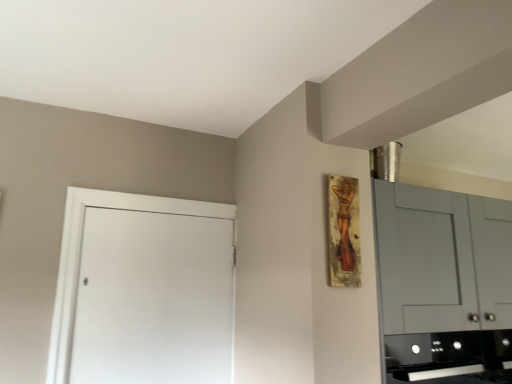
Question: From a real-world perspective, is black glossy oven at lower right physically above white matte door at left?

Choices:
 (A) no
 (B) yes

Answer: (A)

Question: Can you confirm if black glossy oven at lower right is smaller than white matte door at left?

Choices:
 (A) yes
 (B) no

Answer: (B)

Question: Is black glossy oven at lower right positioned with its back to white matte door at left?

Choices:
 (A) yes
 (B) no

Answer: (B)

Question: Does black glossy oven at lower right contain white matte door at left?

Choices:
 (A) yes
 (B) no

Answer: (B)

Question: From a real-world perspective, is black glossy oven at lower right below white matte door at left?

Choices:
 (A) no
 (B) yes

Answer: (B)

Question: Can you confirm if black glossy oven at lower right is positioned to the left of white matte door at left?

Choices:
 (A) yes
 (B) no

Answer: (B)

Question: Is black glossy oven at lower right inside white matte door at left?

Choices:
 (A) no
 (B) yes

Answer: (A)

Question: Is white matte door at left next to black glossy oven at lower right?

Choices:
 (A) yes
 (B) no

Answer: (B)

Question: Can you confirm if white matte door at left is thinner than black glossy oven at lower right?

Choices:
 (A) yes
 (B) no

Answer: (A)

Question: Can we say white matte door at left lies outside black glossy oven at lower right?

Choices:
 (A) yes
 (B) no

Answer: (A)

Question: Does white matte door at left have a larger size compared to black glossy oven at lower right?

Choices:
 (A) no
 (B) yes

Answer: (A)

Question: Is white matte door at left taller than black glossy oven at lower right?

Choices:
 (A) no
 (B) yes

Answer: (B)

Question: Would you say white matte door at left is part of wooden painting at upper right's contents?

Choices:
 (A) yes
 (B) no

Answer: (B)